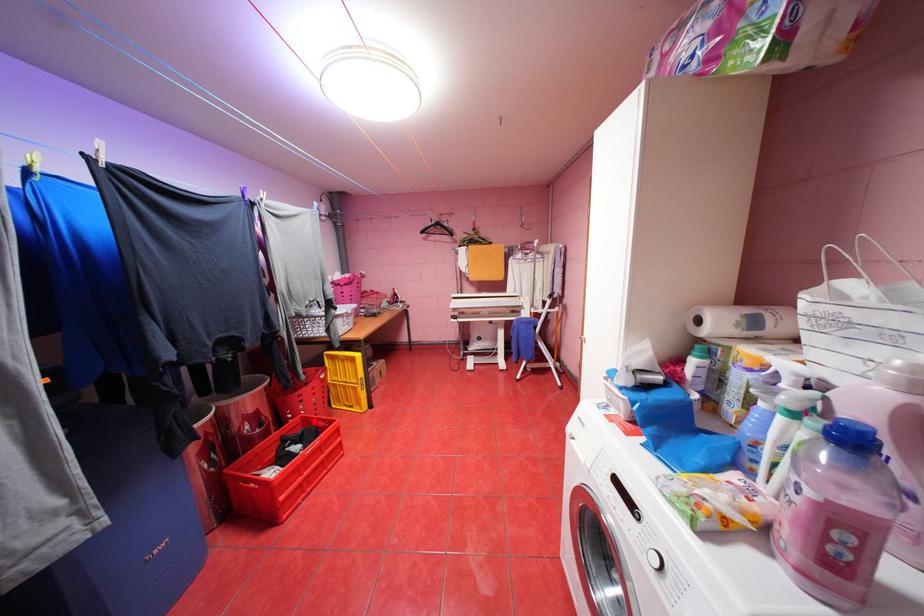
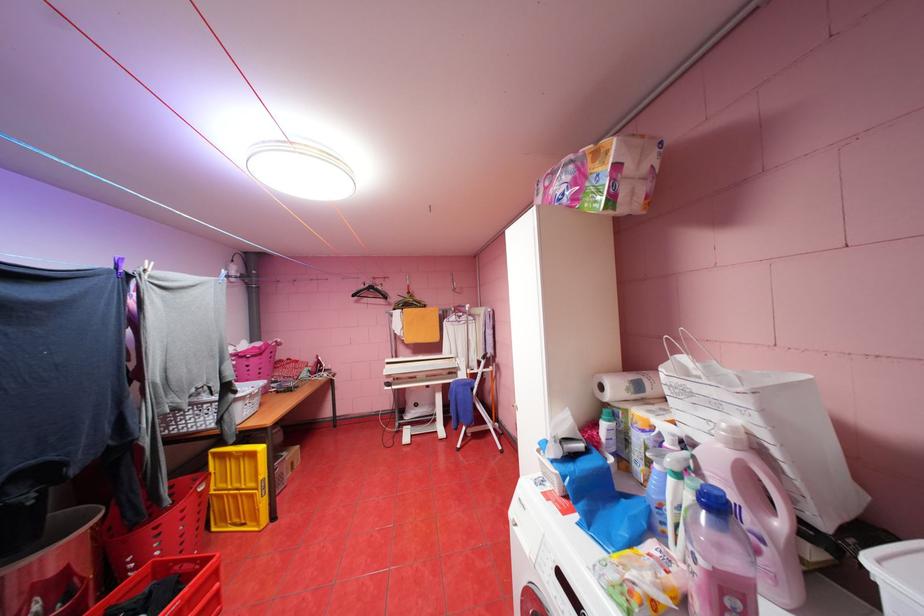
Question: I am providing you with two images of the same scene from different viewpoints. Given a red point in image1, look at the same physical point in image2. Is it:

Choices:
 (A) Closer to the viewpoint
 (B) Farther from the viewpoint

Answer: (B)